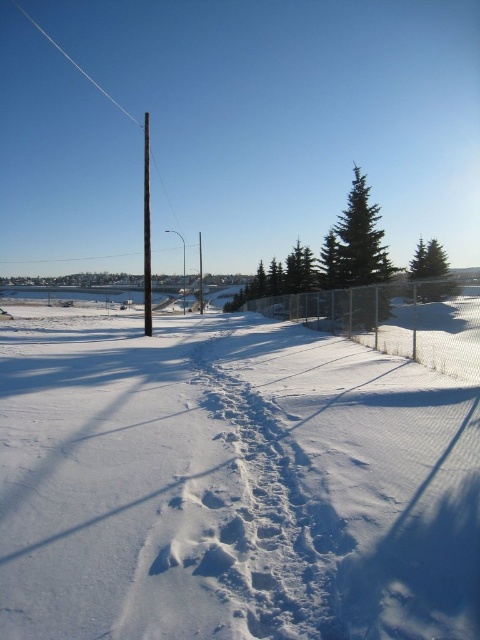
Can you confirm if silver wire mesh fence at center is bigger than white wire at upper center?

No.

Between silver wire mesh fence at center and white wire at upper center, which one appears on the left side from the viewer's perspective?

white wire at upper center is more to the left.

Is point (463, 320) positioned after point (43, 29)?

That is False.

Where is `silver wire mesh fence at center`? silver wire mesh fence at center is located at coordinates (395, 320).

Does white powdery snow at center have a lesser height compared to brown wooden telegraph pole at center-left?

Yes, white powdery snow at center is shorter than brown wooden telegraph pole at center-left.

Is white powdery snow at center bigger than brown wooden telegraph pole at center-left?

Incorrect, white powdery snow at center is not larger than brown wooden telegraph pole at center-left.

Does point (40, 390) come farther from viewer compared to point (199, 236)?

No, (40, 390) is closer to viewer.

Image resolution: width=480 pixels, height=640 pixels. Find the location of `white powdery snow at center`. white powdery snow at center is located at coordinates (229, 483).

Which is more to the right, smooth black pole at center or brown wooden telegraph pole at center-left?

From the viewer's perspective, brown wooden telegraph pole at center-left appears more on the right side.

Who is more distant from viewer, (145, 163) or (201, 310)?

The point (145, 163) is behind.

This screenshot has width=480, height=640. What are the coordinates of `smooth black pole at center` in the screenshot? It's located at (146, 230).